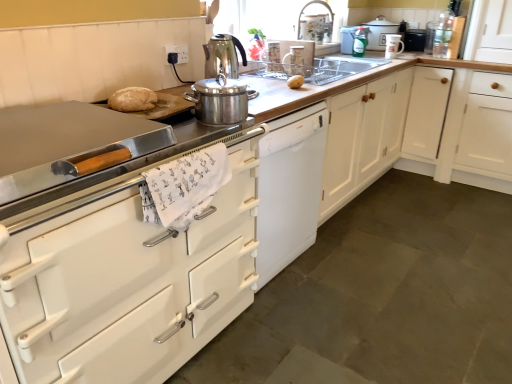
At what (x,y) coordinates should I click in order to perform the action: click on free space to the right of clear glass pitcher at upper center, positioned as the fourth kitchen appliance in back-to-front order. Please return your answer as a coordinate pair (x, y). Image resolution: width=512 pixels, height=384 pixels. Looking at the image, I should click on (323, 71).